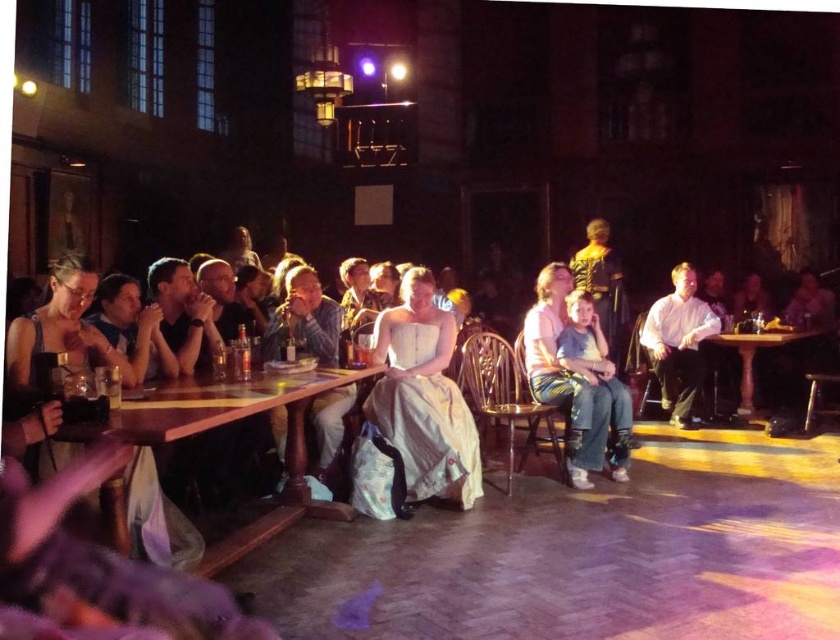
Between white satin dress at center and white cotton shirt at center, which one has more height?

With more height is white cotton shirt at center.

Measure the distance from white satin dress at center to white cotton shirt at center.

A distance of 8.08 feet exists between white satin dress at center and white cotton shirt at center.

You are a GUI agent. You are given a task and a screenshot of the screen. Output one action in this format:
    pyautogui.click(x=<x>, y=<y>)
    Task: Click on the white satin dress at center
    
    Given the screenshot: What is the action you would take?
    pyautogui.click(x=423, y=396)

From the picture: Can you confirm if wooden table at lower left is positioned to the left of wooden table at right?

Correct, you'll find wooden table at lower left to the left of wooden table at right.

Does point (290, 515) lie behind point (799, 339)?

No.

Is point (195, 420) positioned behind point (785, 342)?

No, (195, 420) is in front of (785, 342).

At what (x,y) coordinates should I click in order to perform the action: click on wooden table at lower left. Please return your answer as a coordinate pair (x, y). Looking at the image, I should click on (227, 422).

Is denim jacket at center above light blue jeans at center?

Yes.

Which is behind, point (289, 310) or point (575, 436)?

Point (575, 436)

The height and width of the screenshot is (640, 840). Find the location of `denim jacket at center`. denim jacket at center is located at coordinates (303, 320).

In order to click on denim jacket at center in this screenshot , I will do `click(303, 320)`.